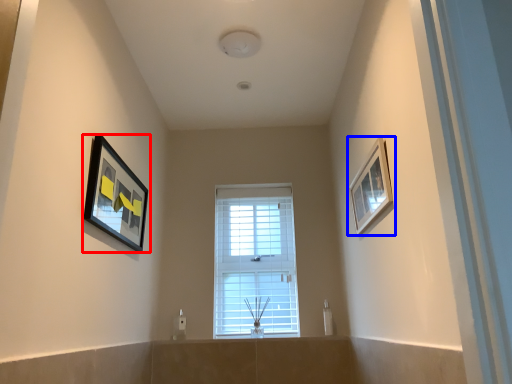
Question: Among these objects, which one is farthest to the camera, picture frame (highlighted by a red box) or picture frame (highlighted by a blue box)?

Choices:
 (A) picture frame
 (B) picture frame

Answer: (A)